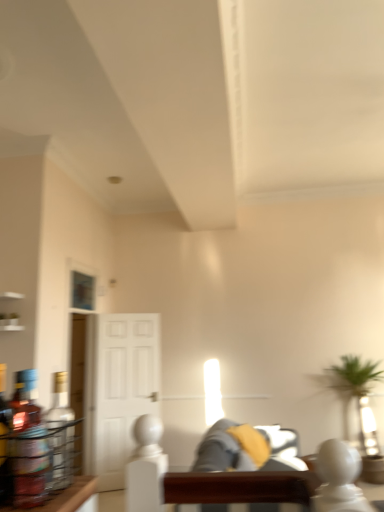
Question: Considering the relative sizes of translucent glass bottle at left, marked as the second bottle in a back-to-front arrangement, and soft gray fabric couch at center, the 1th couch in the front-to-back sequence, in the image provided, is translucent glass bottle at left, marked as the second bottle in a back-to-front arrangement, taller than soft gray fabric couch at center, the 1th couch in the front-to-back sequence,?

Choices:
 (A) no
 (B) yes

Answer: (A)

Question: Is soft gray fabric couch at center, positioned as the second couch in back-to-front order, a part of translucent glass bottle at left, marked as the second bottle in a back-to-front arrangement?

Choices:
 (A) no
 (B) yes

Answer: (A)

Question: Considering the relative positions of translucent glass bottle at left, marked as the second bottle in a back-to-front arrangement, and soft gray fabric couch at center, the 1th couch in the front-to-back sequence, in the image provided, is translucent glass bottle at left, marked as the second bottle in a back-to-front arrangement, to the right of soft gray fabric couch at center, the 1th couch in the front-to-back sequence, from the viewer's perspective?

Choices:
 (A) yes
 (B) no

Answer: (B)

Question: Does translucent glass bottle at left, marked as the second bottle in a back-to-front arrangement, appear on the left side of soft gray fabric couch at center, the 1th couch in the front-to-back sequence?

Choices:
 (A) no
 (B) yes

Answer: (B)

Question: Is translucent glass bottle at left, marked as the second bottle in a back-to-front arrangement, thinner than soft gray fabric couch at center, the 1th couch in the front-to-back sequence?

Choices:
 (A) no
 (B) yes

Answer: (B)

Question: Is white glossy door at center in front of or behind translucent glass bottle at left, the 1th bottle from the back, in the image?

Choices:
 (A) behind
 (B) front

Answer: (A)

Question: From a real-world perspective, is white glossy door at center above or below translucent glass bottle at left, the 1th bottle from the back?

Choices:
 (A) above
 (B) below

Answer: (B)

Question: From their relative heights in the image, would you say white glossy door at center is taller or shorter than translucent glass bottle at left, the 1th bottle from the back?

Choices:
 (A) tall
 (B) short

Answer: (A)

Question: From the image's perspective, relative to translucent glass bottle at left, the second bottle in the front-to-back sequence, is white glossy door at center above or below?

Choices:
 (A) above
 (B) below

Answer: (B)

Question: Do you think gray fabric couch at center, the 1th couch positioned from the back, is within translucent glass bottle at left, marked as the second bottle in a back-to-front arrangement, or outside of it?

Choices:
 (A) inside
 (B) outside

Answer: (B)

Question: In terms of width, does gray fabric couch at center, arranged as the 2th couch when viewed from the front, look wider or thinner when compared to translucent glass bottle at left, placed as the 1th bottle when sorted from front to back?

Choices:
 (A) thin
 (B) wide

Answer: (B)

Question: Is gray fabric couch at center, the 1th couch positioned from the back, in front of or behind translucent glass bottle at left, placed as the 1th bottle when sorted from front to back, in the image?

Choices:
 (A) front
 (B) behind

Answer: (B)

Question: Based on their positions, is gray fabric couch at center, arranged as the 2th couch when viewed from the front, located to the left or right of translucent glass bottle at left, marked as the second bottle in a back-to-front arrangement?

Choices:
 (A) right
 (B) left

Answer: (A)

Question: In terms of height, does translucent glass bottle at left, the second bottle in the front-to-back sequence, look taller or shorter compared to gray fabric couch at center, the 1th couch positioned from the back?

Choices:
 (A) short
 (B) tall

Answer: (A)

Question: Is translucent glass bottle at left, the 1th bottle from the back, spatially inside gray fabric couch at center, arranged as the 2th couch when viewed from the front, or outside of it?

Choices:
 (A) inside
 (B) outside

Answer: (B)